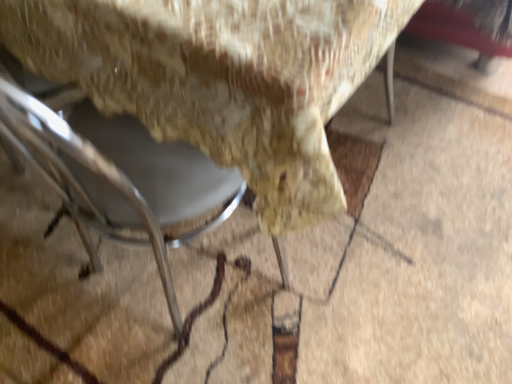
Question: Would you say metallic gray chair at lower left, which is counted as the first chair, starting from the right, is part of metallic gray chair at lower left, the second chair from the right,'s contents?

Choices:
 (A) no
 (B) yes

Answer: (A)

Question: From the image's perspective, is metallic gray chair at lower left, the second chair from the right, beneath metallic gray chair at lower left, which is counted as the first chair, starting from the right?

Choices:
 (A) no
 (B) yes

Answer: (B)

Question: Considering the relative sizes of metallic gray chair at lower left, the 1th chair when ordered from left to right, and metallic gray chair at lower left, which is counted as the first chair, starting from the right, in the image provided, is metallic gray chair at lower left, the 1th chair when ordered from left to right, shorter than metallic gray chair at lower left, which is counted as the first chair, starting from the right,?

Choices:
 (A) yes
 (B) no

Answer: (B)

Question: Is metallic gray chair at lower left, the 1th chair when ordered from left to right, bigger than metallic gray chair at lower left, which appears as the second chair when viewed from the left?

Choices:
 (A) no
 (B) yes

Answer: (A)

Question: Are metallic gray chair at lower left, the second chair from the right, and metallic gray chair at lower left, which appears as the second chair when viewed from the left, far apart?

Choices:
 (A) no
 (B) yes

Answer: (A)

Question: Does metallic gray chair at lower left, the second chair from the right, have a greater height compared to metallic gray chair at lower left, which appears as the second chair when viewed from the left?

Choices:
 (A) yes
 (B) no

Answer: (A)

Question: Considering the relative positions of metallic gray chair at lower left, which is counted as the first chair, starting from the right, and metallic gray chair at lower left, the 1th chair when ordered from left to right, in the image provided, is metallic gray chair at lower left, which is counted as the first chair, starting from the right, behind metallic gray chair at lower left, the 1th chair when ordered from left to right,?

Choices:
 (A) yes
 (B) no

Answer: (A)

Question: Are metallic gray chair at lower left, which appears as the second chair when viewed from the left, and metallic gray chair at lower left, the 1th chair when ordered from left to right, far apart?

Choices:
 (A) yes
 (B) no

Answer: (B)

Question: Is the depth of metallic gray chair at lower left, which appears as the second chair when viewed from the left, less than that of metallic gray chair at lower left, the 1th chair when ordered from left to right?

Choices:
 (A) no
 (B) yes

Answer: (A)

Question: Does metallic gray chair at lower left, which appears as the second chair when viewed from the left, turn towards metallic gray chair at lower left, the second chair from the right?

Choices:
 (A) no
 (B) yes

Answer: (B)

Question: From a real-world perspective, is metallic gray chair at lower left, which is counted as the first chair, starting from the right, located beneath metallic gray chair at lower left, the 1th chair when ordered from left to right?

Choices:
 (A) no
 (B) yes

Answer: (B)

Question: Is metallic gray chair at lower left, the 1th chair when ordered from left to right, completely or partially inside metallic gray chair at lower left, which is counted as the first chair, starting from the right?

Choices:
 (A) yes
 (B) no

Answer: (A)

Question: Visually, is metallic gray chair at lower left, the 1th chair when ordered from left to right, positioned to the left or to the right of metallic gray chair at lower left, which appears as the second chair when viewed from the left?

Choices:
 (A) left
 (B) right

Answer: (A)